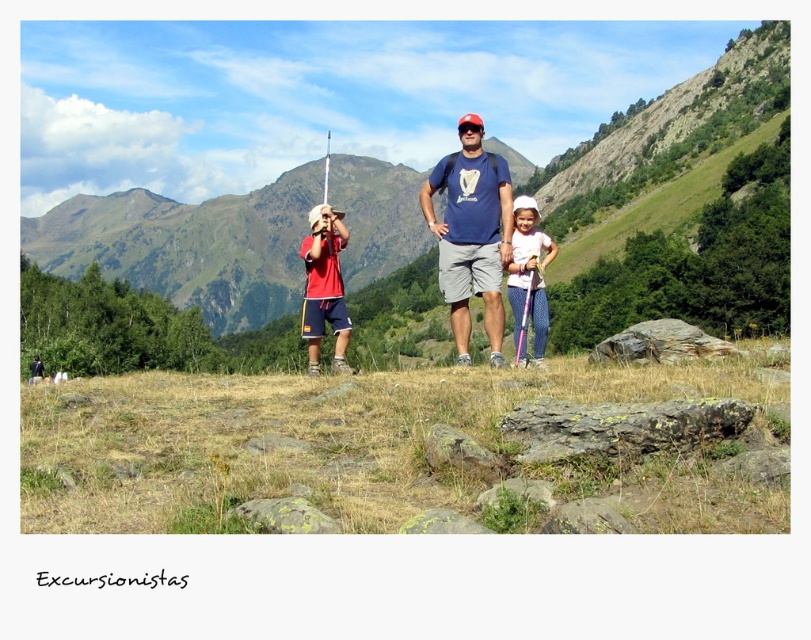
Question: Does blue t-shirt at center lie in front of pink fabric dress at center?

Choices:
 (A) yes
 (B) no

Answer: (A)

Question: Is green grassy mountain at center behind pink fabric dress at center?

Choices:
 (A) yes
 (B) no

Answer: (A)

Question: Which point is closer to the camera?

Choices:
 (A) (535, 364)
 (B) (457, 262)

Answer: (A)

Question: Which point is closer to the camera taking this photo?

Choices:
 (A) (418, 234)
 (B) (545, 243)
 (C) (461, 140)

Answer: (B)

Question: Does green grassy mountain at center have a larger size compared to blue t-shirt at center?

Choices:
 (A) no
 (B) yes

Answer: (B)

Question: Considering the real-world distances, which object is farthest from the blue t-shirt at center?

Choices:
 (A) pink fabric dress at center
 (B) green grassy mountain at center

Answer: (B)